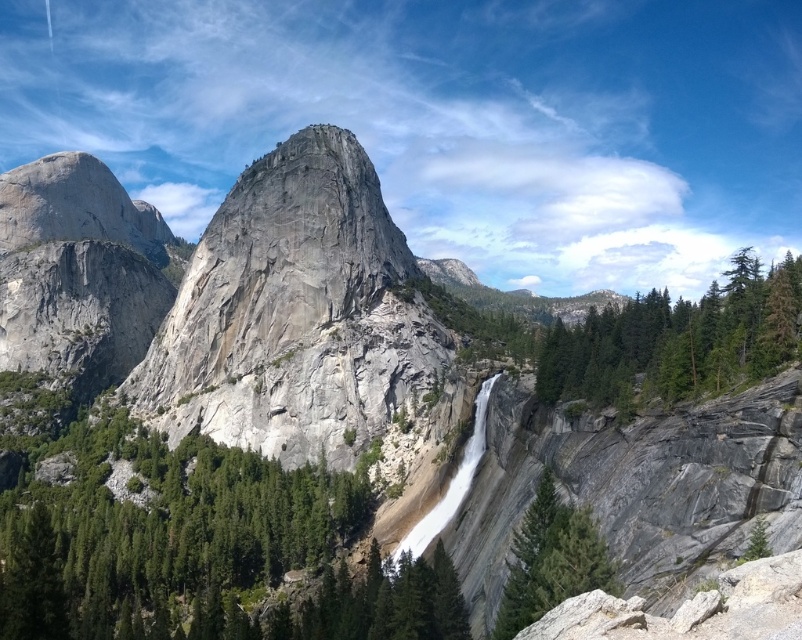
You are a hiker planning to take a photo of the green textured rock at center and the green textured tree at right from a viewpoint. Which object should you position closer to the left side of your camera frame to include both in the shot?

The green textured rock at center is positioned on the left side of the green textured tree at right, so you should position the green textured rock at center closer to the left side of your camera frame to include both in the shot.